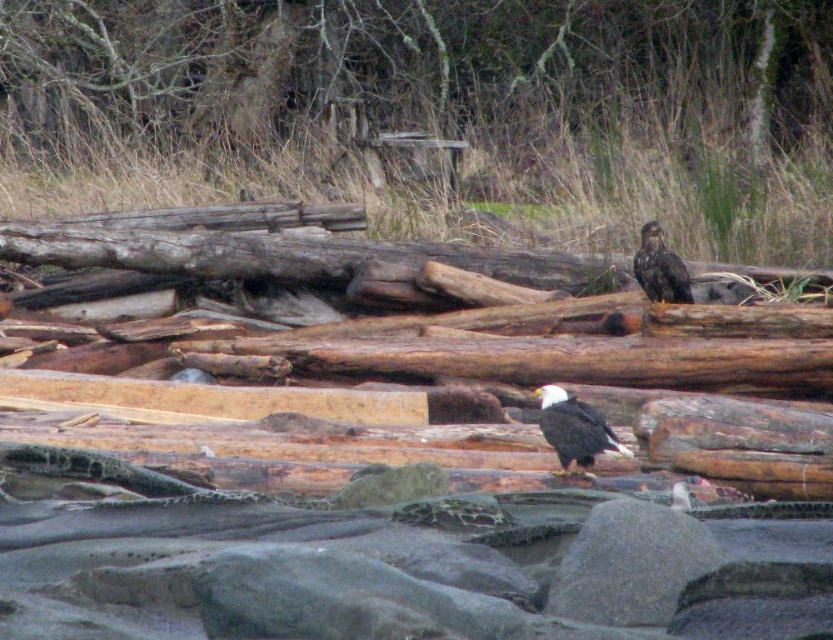
Which is behind, point (669, 536) or point (641, 273)?

Positioned behind is point (641, 273).

Is gray rough rock at lower center smaller than dark brown feathers at upper right?

Incorrect, gray rough rock at lower center is not smaller in size than dark brown feathers at upper right.

Is point (611, 609) farther from viewer compared to point (682, 292)?

No, (611, 609) is in front of (682, 292).

What are the coordinates of `gray rough rock at lower center` in the screenshot? It's located at (631, 564).

Is gray rough rock at lower center smaller than white-feathered bald eagle at center?

No.

Does gray rough rock at lower center come behind white-feathered bald eagle at center?

No, it is not.

Is point (620, 557) positioned before point (580, 461)?

Yes, point (620, 557) is in front of point (580, 461).

Where is `gray rough rock at lower center`? The image size is (833, 640). gray rough rock at lower center is located at coordinates (631, 564).

Who is lower down, brown rough wood at upper center or white-feathered bald eagle at center?

white-feathered bald eagle at center is lower down.

Is point (659, 10) positioned behind point (586, 449)?

Yes, point (659, 10) is behind point (586, 449).

Where is `brown rough wood at upper center`? brown rough wood at upper center is located at coordinates (420, 60).